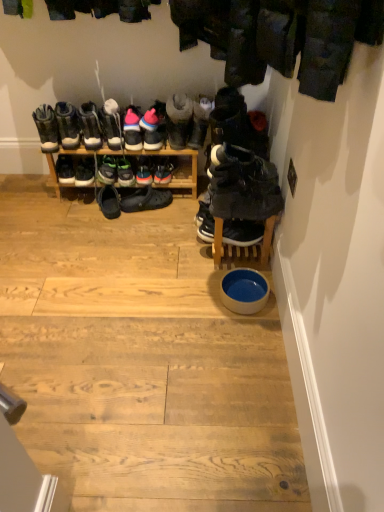
Question: Relative to black suede sneakers at center, which is the fifteenth footwear from left to right, is pink suede sneakers at center, the 6th footwear from the right, in front or behind?

Choices:
 (A) front
 (B) behind

Answer: (B)

Question: From the image's perspective, is pink suede sneakers at center, arranged as the 11th footwear when viewed from the left, positioned above or below black suede sneakers at center, arranged as the second footwear when viewed from the right?

Choices:
 (A) below
 (B) above

Answer: (B)

Question: Which of these objects is positioned closest to the matte black boot at left, marked as the first footwear in a left-to-right arrangement?

Choices:
 (A) black suede sneakers at center, which is the sixteenth footwear in left-to-right order
 (B) white glossy bowl at center
 (C) black matte sneaker at upper right, the 14th footwear viewed from the left
 (D) suede sneakers at center, marked as the fifth footwear in a right-to-left arrangement
 (E) pink suede sneakers at center, the tenth footwear from the right

Answer: (E)

Question: Estimate the real-world distances between objects in this image. Which object is closer to the pink suede sneakers at center, the tenth footwear from the right?

Choices:
 (A) green matte sneakers at center, the thirteenth footwear in the right-to-left sequence
 (B) suede sneakers at center, marked as the fifth footwear in a right-to-left arrangement
 (C) white suede sneakers at center, which is the fifth footwear from left to right
 (D) leather boots at left, the 15th footwear in the right-to-left sequence
 (E) pink suede sneakers at center, the 6th footwear from the right

Answer: (C)